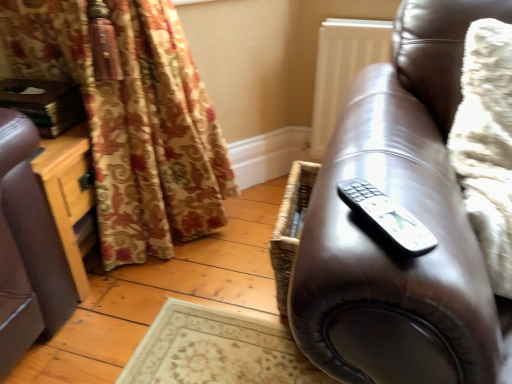
Question: Is the depth of matte brown leather couch at right less than that of white plastic remote at right?

Choices:
 (A) yes
 (B) no

Answer: (A)

Question: Is matte brown leather couch at right oriented away from white plastic remote at right?

Choices:
 (A) yes
 (B) no

Answer: (B)

Question: Is matte brown leather couch at right positioned behind white plastic remote at right?

Choices:
 (A) yes
 (B) no

Answer: (B)

Question: Can you confirm if matte brown leather couch at right is taller than white plastic remote at right?

Choices:
 (A) yes
 (B) no

Answer: (A)

Question: From a real-world perspective, does matte brown leather couch at right sit lower than white plastic remote at right?

Choices:
 (A) yes
 (B) no

Answer: (A)

Question: Considering the relative sizes of matte brown leather couch at right and white plastic remote at right in the image provided, is matte brown leather couch at right smaller than white plastic remote at right?

Choices:
 (A) yes
 (B) no

Answer: (B)

Question: Is white plastic remote at right directly adjacent to matte brown leather couch at right?

Choices:
 (A) yes
 (B) no

Answer: (B)

Question: Is white plastic remote at right turned away from matte brown leather couch at right?

Choices:
 (A) yes
 (B) no

Answer: (A)

Question: Does white plastic remote at right come behind matte brown leather couch at right?

Choices:
 (A) yes
 (B) no

Answer: (A)

Question: From the image's perspective, would you say white plastic remote at right is positioned over matte brown leather couch at right?

Choices:
 (A) yes
 (B) no

Answer: (A)

Question: Could you tell me if white plastic remote at right is turned towards matte brown leather couch at right?

Choices:
 (A) yes
 (B) no

Answer: (A)

Question: Considering the relative sizes of white plastic remote at right and matte brown leather couch at right in the image provided, is white plastic remote at right bigger than matte brown leather couch at right?

Choices:
 (A) yes
 (B) no

Answer: (B)

Question: Is white plastic remote at right wider or thinner than matte brown leather couch at right?

Choices:
 (A) wide
 (B) thin

Answer: (B)